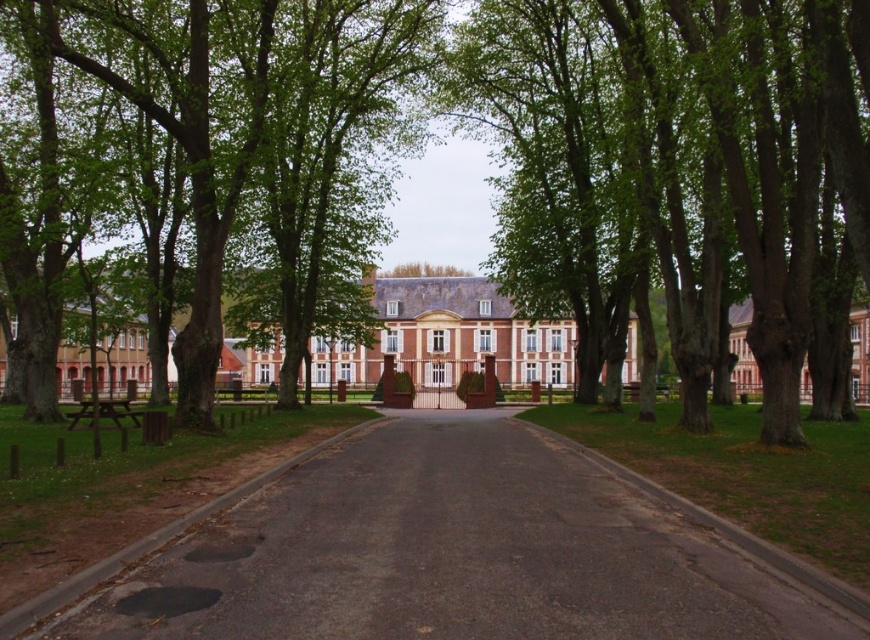
Question: Can you confirm if smooth bark tree at center is smaller than green leafy tree at center?

Choices:
 (A) yes
 (B) no

Answer: (B)

Question: Which point is farther from the camera taking this photo?

Choices:
 (A) (794, 323)
 (B) (389, 490)

Answer: (A)

Question: Which point appears closest to the camera in this image?

Choices:
 (A) (775, 227)
 (B) (715, 620)
 (C) (422, 291)
 (D) (690, 29)

Answer: (B)

Question: Which point is closer to the camera?

Choices:
 (A) green leafy tree at center
 (B) black asphalt road at center
 (C) smooth bark tree at center

Answer: (B)

Question: Can you confirm if smooth bark tree at center is positioned below brick building at center?

Choices:
 (A) yes
 (B) no

Answer: (B)

Question: Can you confirm if black asphalt road at center is positioned below smooth bark tree at center?

Choices:
 (A) no
 (B) yes

Answer: (B)